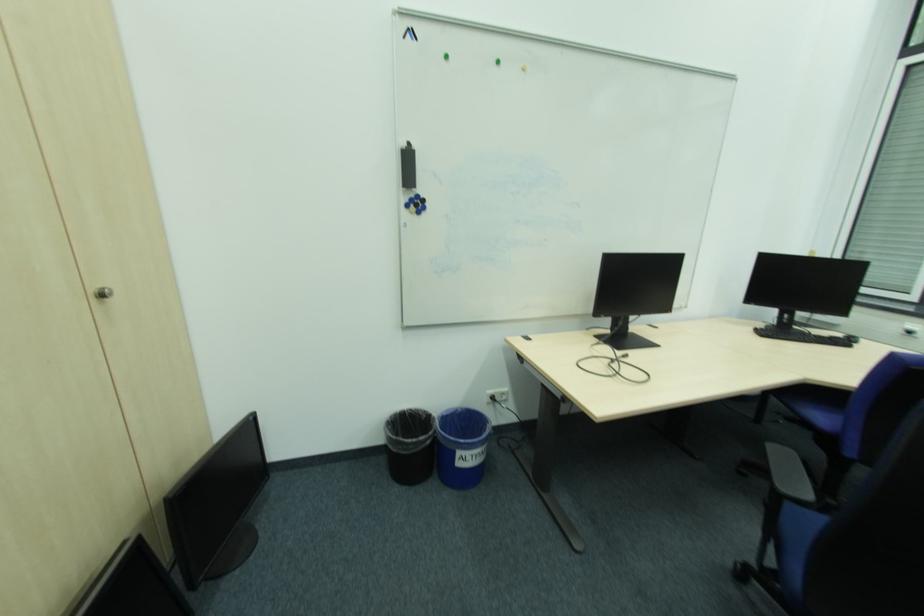
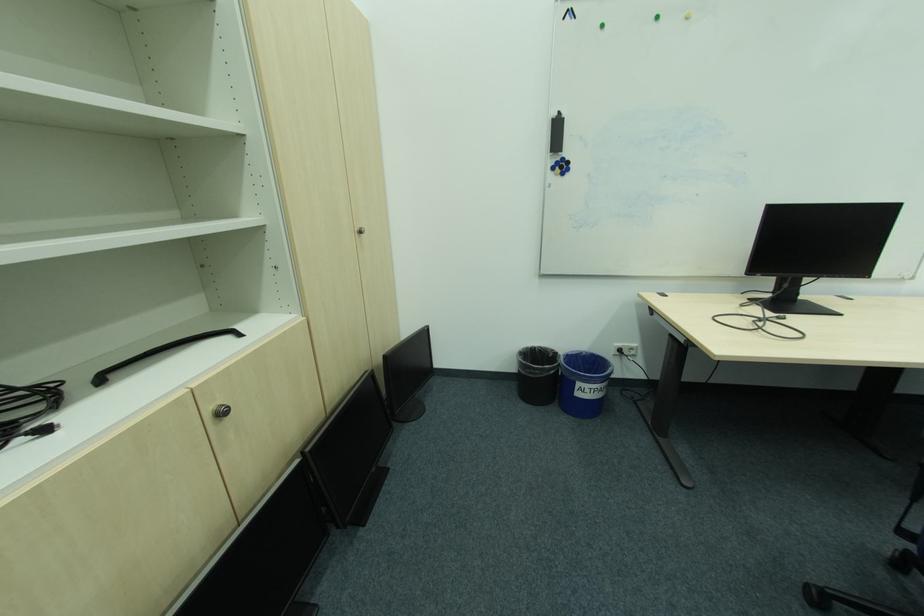
Locate, in the second image, the point that corresponds to (x=475, y=459) in the first image.

(593, 391)